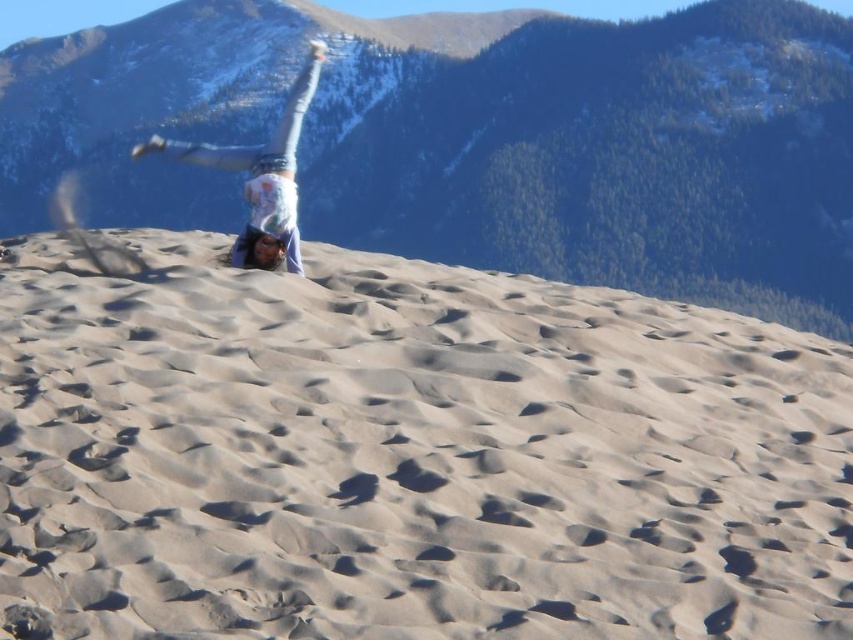
Which of these two, smooth beige sand at center or light blue denim jeans at upper center, stands shorter?

smooth beige sand at center

Which is behind, point (560, 548) or point (291, 202)?

Positioned behind is point (291, 202).

This screenshot has height=640, width=853. What are the coordinates of `smooth beige sand at center` in the screenshot? It's located at (408, 456).

Which is more to the right, smooth beige sand at center or green forested mountain at upper center?

smooth beige sand at center

Is point (538, 385) closer to viewer compared to point (596, 166)?

Yes, it is.

The width and height of the screenshot is (853, 640). What are the coordinates of `smooth beige sand at center` in the screenshot? It's located at pos(408,456).

Who is positioned more to the left, green forested mountain at upper center or light blue denim jeans at upper center?

light blue denim jeans at upper center is more to the left.

Is green forested mountain at upper center below light blue denim jeans at upper center?

No.

Which is behind, point (790, 317) or point (265, 168)?

Positioned behind is point (790, 317).

The height and width of the screenshot is (640, 853). In order to click on green forested mountain at upper center in this screenshot , I will do `click(605, 154)`.